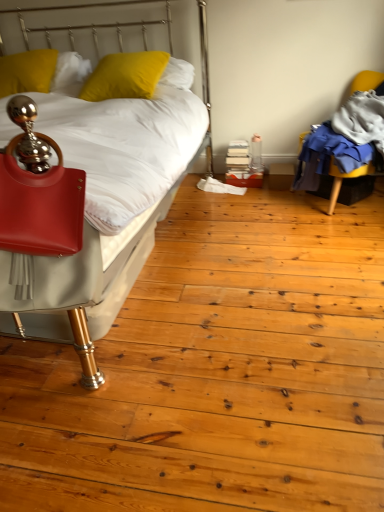
What are the coordinates of `yellow fabric chair at right` in the screenshot? It's located at (342, 179).

At what (x,y) coordinates should I click in order to perform the action: click on yellow matte pillow at upper left, positioned as the 1th pillow in right-to-left order. Please return your answer as a coordinate pair (x, y). Looking at the image, I should click on (125, 76).

Describe the element at coordinates (27, 71) in the screenshot. I see `yellow matte pillow at upper left, arranged as the second pillow when viewed from the right` at that location.

Locate an element on the screen. matte white bed at left is located at coordinates (86, 281).

Is point (108, 92) farther from viewer compared to point (10, 58)?

No, (108, 92) is in front of (10, 58).

Is yellow matte pillow at upper left, which is the 2th pillow in left-to-right order, located outside yellow matte pillow at upper left, which is the first pillow in left-to-right order?

Indeed, yellow matte pillow at upper left, which is the 2th pillow in left-to-right order, is completely outside yellow matte pillow at upper left, which is the first pillow in left-to-right order.

What's the angular difference between yellow matte pillow at upper left, which is the 2th pillow in left-to-right order, and yellow matte pillow at upper left, arranged as the second pillow when viewed from the right,'s facing directions?

The angle between the facing direction of yellow matte pillow at upper left, which is the 2th pillow in left-to-right order, and the facing direction of yellow matte pillow at upper left, arranged as the second pillow when viewed from the right, is 10.8 degrees.

Considering the sizes of objects yellow matte pillow at upper left, positioned as the 1th pillow in right-to-left order, and yellow matte pillow at upper left, which is the first pillow in left-to-right order, in the image provided, who is thinner, yellow matte pillow at upper left, positioned as the 1th pillow in right-to-left order, or yellow matte pillow at upper left, which is the first pillow in left-to-right order,?

yellow matte pillow at upper left, which is the first pillow in left-to-right order.

Can you confirm if yellow matte pillow at upper left, which is the first pillow in left-to-right order, is bigger than yellow fabric chair at right?

Incorrect, yellow matte pillow at upper left, which is the first pillow in left-to-right order, is not larger than yellow fabric chair at right.

From a real-world perspective, is yellow matte pillow at upper left, which is the first pillow in left-to-right order, positioned above or below yellow fabric chair at right?

yellow matte pillow at upper left, which is the first pillow in left-to-right order, is above yellow fabric chair at right.

From the image's perspective, between yellow matte pillow at upper left, which is the first pillow in left-to-right order, and yellow fabric chair at right, who is located below?

yellow fabric chair at right, from the image's perspective.

Is point (109, 81) in front of point (41, 254)?

No, (109, 81) is behind (41, 254).

From a real-world perspective, is yellow matte pillow at upper left, which is the 2th pillow in left-to-right order, positioned above or below matte red handbag at left?

yellow matte pillow at upper left, which is the 2th pillow in left-to-right order, is situated higher than matte red handbag at left in the real world.

Between yellow matte pillow at upper left, which is the 2th pillow in left-to-right order, and matte red handbag at left, which one has smaller size?

matte red handbag at left.

Considering the sizes of yellow matte pillow at upper left, which is the 2th pillow in left-to-right order, and matte red handbag at left in the image, is yellow matte pillow at upper left, which is the 2th pillow in left-to-right order, taller or shorter than matte red handbag at left?

yellow matte pillow at upper left, which is the 2th pillow in left-to-right order, is shorter than matte red handbag at left.

Between matte white bed at left and yellow matte pillow at upper left, which is the first pillow in left-to-right order, which one has more height?

Standing taller between the two is matte white bed at left.

Does matte white bed at left come behind yellow matte pillow at upper left, which is the first pillow in left-to-right order?

No, it is in front of yellow matte pillow at upper left, which is the first pillow in left-to-right order.

Is there a large distance between matte white bed at left and yellow matte pillow at upper left, which is the first pillow in left-to-right order?

Yes, matte white bed at left and yellow matte pillow at upper left, which is the first pillow in left-to-right order, are located far from each other.

Is point (37, 86) closer to viewer compared to point (48, 167)?

No.

Can you confirm if yellow matte pillow at upper left, arranged as the second pillow when viewed from the right, is thinner than matte red handbag at left?

No, yellow matte pillow at upper left, arranged as the second pillow when viewed from the right, is not thinner than matte red handbag at left.

From the image's perspective, is yellow matte pillow at upper left, arranged as the second pillow when viewed from the right, above matte white bed at left?

Yes, from the image's perspective, yellow matte pillow at upper left, arranged as the second pillow when viewed from the right, is over matte white bed at left.

Is yellow matte pillow at upper left, arranged as the second pillow when viewed from the right, positioned beyond the bounds of matte white bed at left?

No, yellow matte pillow at upper left, arranged as the second pillow when viewed from the right, is inside or overlapping with matte white bed at left.

Does yellow matte pillow at upper left, arranged as the second pillow when viewed from the right, have a lesser height compared to matte white bed at left?

Yes, yellow matte pillow at upper left, arranged as the second pillow when viewed from the right, is shorter than matte white bed at left.

In the scene shown: In the image, is matte red handbag at left positioned in front of or behind yellow fabric chair at right?

Visually, matte red handbag at left is located in front of yellow fabric chair at right.

The width and height of the screenshot is (384, 512). What are the coordinates of `chair behind the matte red handbag at left` in the screenshot? It's located at (342, 179).

From the image's perspective, does matte red handbag at left appear higher than yellow fabric chair at right?

No, from the image's perspective, matte red handbag at left is not over yellow fabric chair at right.

Which of these two, matte red handbag at left or yellow fabric chair at right, is smaller?

With smaller size is matte red handbag at left.

The height and width of the screenshot is (512, 384). What are the coordinates of `pillow in front of the yellow matte pillow at upper left, which is the first pillow in left-to-right order` in the screenshot? It's located at (125, 76).

You are a GUI agent. You are given a task and a screenshot of the screen. Output one action in this format:
    pyautogui.click(x=<x>, y=<y>)
    Task: Click on the 2nd pillow to the left of the yellow fabric chair at right, starting your count from the anchor
    The image size is (384, 512).
    Given the screenshot: What is the action you would take?
    pyautogui.click(x=27, y=71)

Estimate the real-world distances between objects in this image. Which object is closer to yellow matte pillow at upper left, arranged as the second pillow when viewed from the right, yellow matte pillow at upper left, positioned as the 1th pillow in right-to-left order, or yellow fabric chair at right?

yellow matte pillow at upper left, positioned as the 1th pillow in right-to-left order.

Looking at this image, looking at the image, which one is located closer to matte white bed at left, yellow matte pillow at upper left, which is the 2th pillow in left-to-right order, or yellow fabric chair at right?

The object closer to matte white bed at left is yellow matte pillow at upper left, which is the 2th pillow in left-to-right order.

Considering their positions, is yellow fabric chair at right positioned further to yellow matte pillow at upper left, positioned as the 1th pillow in right-to-left order, than matte red handbag at left?

yellow fabric chair at right is further to yellow matte pillow at upper left, positioned as the 1th pillow in right-to-left order.

From the image, which object appears to be farther from yellow matte pillow at upper left, which is the first pillow in left-to-right order, yellow fabric chair at right or matte red handbag at left?

yellow fabric chair at right.

Considering their positions, is yellow matte pillow at upper left, which is the first pillow in left-to-right order, positioned closer to matte white bed at left than yellow matte pillow at upper left, which is the 2th pillow in left-to-right order?

Among the two, yellow matte pillow at upper left, which is the 2th pillow in left-to-right order, is located nearer to matte white bed at left.

From the image, which object appears to be farther from matte white bed at left, matte red handbag at left or yellow fabric chair at right?

Among the two, yellow fabric chair at right is located further to matte white bed at left.

Which object lies nearer to the anchor point yellow matte pillow at upper left, which is the 2th pillow in left-to-right order, yellow matte pillow at upper left, arranged as the second pillow when viewed from the right, or matte red handbag at left?

yellow matte pillow at upper left, arranged as the second pillow when viewed from the right.

Based on the photo, considering their positions, is yellow fabric chair at right positioned further to matte red handbag at left than yellow matte pillow at upper left, which is the first pillow in left-to-right order?

yellow fabric chair at right is further to matte red handbag at left.

This screenshot has height=512, width=384. I want to click on pillow located between yellow matte pillow at upper left, arranged as the second pillow when viewed from the right, and yellow fabric chair at right in the left-right direction, so click(x=125, y=76).

You are a GUI agent. You are given a task and a screenshot of the screen. Output one action in this format:
    pyautogui.click(x=<x>, y=<y>)
    Task: Click on the handbag between yellow matte pillow at upper left, arranged as the second pillow when viewed from the right, and yellow fabric chair at right, in the horizontal direction
    The image size is (384, 512).
    Given the screenshot: What is the action you would take?
    pyautogui.click(x=38, y=192)

This screenshot has width=384, height=512. I want to click on handbag between matte white bed at left and yellow matte pillow at upper left, positioned as the 1th pillow in right-to-left order, from front to back, so click(38, 192).

Where is `handbag positioned between matte white bed at left and yellow matte pillow at upper left, arranged as the second pillow when viewed from the right, from near to far`? handbag positioned between matte white bed at left and yellow matte pillow at upper left, arranged as the second pillow when viewed from the right, from near to far is located at coordinates (38, 192).